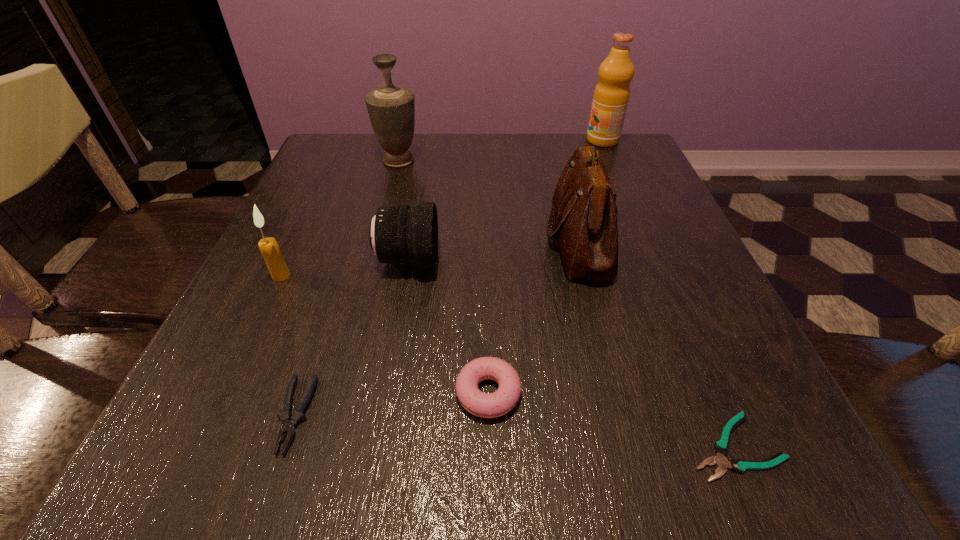
Image resolution: width=960 pixels, height=540 pixels. Find the location of `the taller pliers`. the taller pliers is located at coordinates (289, 421).

Identify the location of the shortest object. The width and height of the screenshot is (960, 540). (721, 447).

At what (x,y) coordinates should I click in order to perform the action: click on the shorter pliers. Please return your answer as a coordinate pair (x, y). The height and width of the screenshot is (540, 960). Looking at the image, I should click on (721, 447).

You are a GUI agent. You are given a task and a screenshot of the screen. Output one action in this format:
    pyautogui.click(x=<x>, y=<y>)
    Task: Click on the vacant space located 0.200m on the front label of the fruit juice
    This screenshot has height=540, width=960.
    Given the screenshot: What is the action you would take?
    pyautogui.click(x=510, y=140)

Where is `vacant space positioned 0.120m on the front label of the fruit juice`? Image resolution: width=960 pixels, height=540 pixels. vacant space positioned 0.120m on the front label of the fruit juice is located at coordinates point(540,140).

Image resolution: width=960 pixels, height=540 pixels. Find the location of `blank space located 0.340m on the front label of the fruit juice`. blank space located 0.340m on the front label of the fruit juice is located at coordinates (456, 140).

Locate an element on the screen. Image resolution: width=960 pixels, height=540 pixels. free point located 0.130m on the right of the urn is located at coordinates (474, 160).

You are a GUI agent. You are given a task and a screenshot of the screen. Output one action in this format:
    pyautogui.click(x=<x>, y=<y>)
    Task: Click on the free space located on the right of the third object from right to left
    The height and width of the screenshot is (540, 960).
    Given the screenshot: What is the action you would take?
    pyautogui.click(x=674, y=240)

Find the location of a particular element. This screenshot has height=540, width=960. vacant space located 0.250m on the front of the leftmost object is located at coordinates (217, 411).

I want to click on free space located at the front element of the fourth shortest object, so click(x=616, y=260).